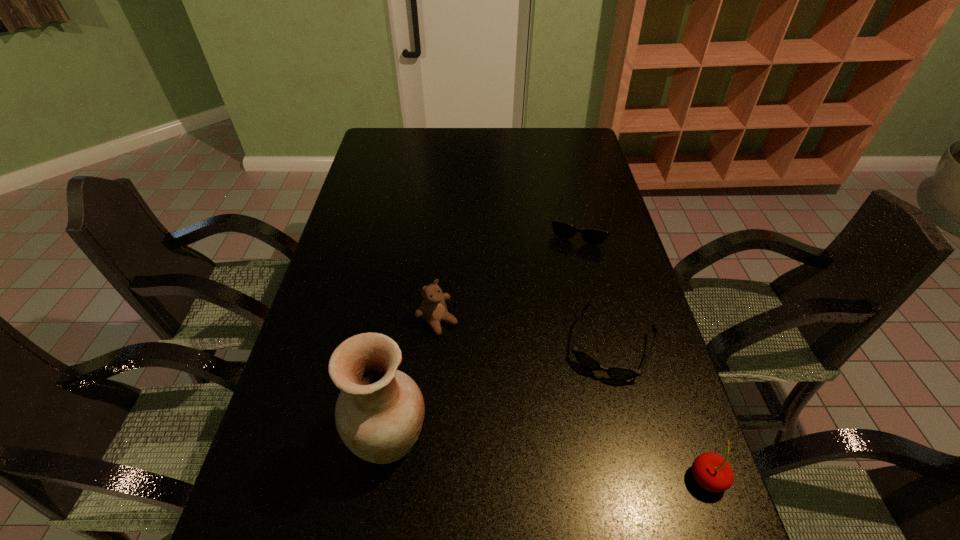
Locate an element on the screen. vacant space on the desktop that is between the pottery and the cherry and is positioned at the front lenses of the farther sunglasses is located at coordinates (515, 453).

The width and height of the screenshot is (960, 540). In order to click on free space on the desktop that is between the tallest object and the cherry and is positioned on the front-facing side of the teddy bear in this screenshot , I will do `click(578, 462)`.

The image size is (960, 540). Identify the location of vacant spot on the desktop that is between the tallest object and the cherry and is positioned on the lenses of the nearer sunglasses. (576, 462).